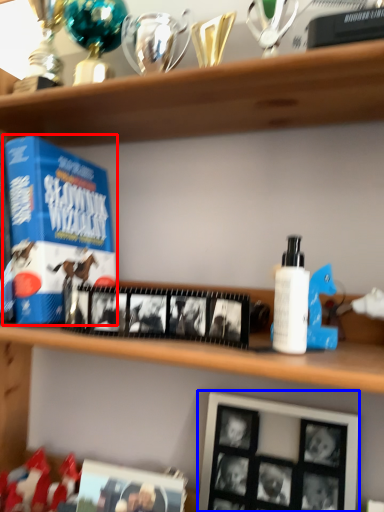
Question: Among these objects, which one is farthest to the camera, product (highlighted by a red box) or picture frame (highlighted by a blue box)?

Choices:
 (A) product
 (B) picture frame

Answer: (A)